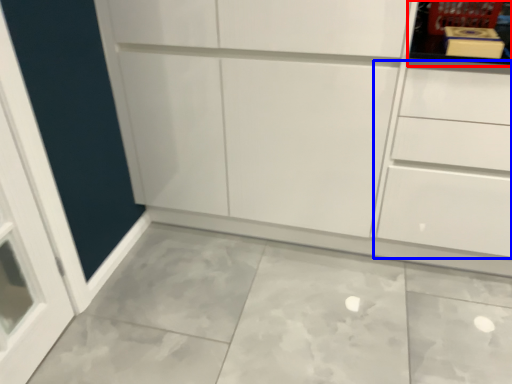
Question: Which object appears farthest to the camera in this image, shelf (highlighted by a red box) or drawer (highlighted by a blue box)?

Choices:
 (A) shelf
 (B) drawer

Answer: (A)